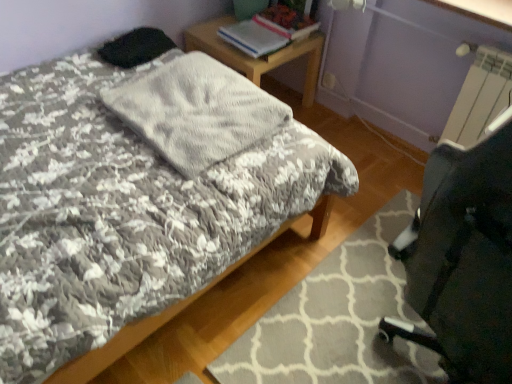
Question: Is fluffy gray blanket at center further to camera compared to gray textured rug at lower right?

Choices:
 (A) no
 (B) yes

Answer: (B)

Question: Is fluffy gray blanket at center bigger than gray textured rug at lower right?

Choices:
 (A) yes
 (B) no

Answer: (B)

Question: Considering the relative sizes of fluffy gray blanket at center and gray textured rug at lower right in the image provided, is fluffy gray blanket at center smaller than gray textured rug at lower right?

Choices:
 (A) no
 (B) yes

Answer: (B)

Question: Could you tell me if fluffy gray blanket at center is facing gray textured rug at lower right?

Choices:
 (A) no
 (B) yes

Answer: (A)

Question: From the image's perspective, would you say fluffy gray blanket at center is shown under gray textured rug at lower right?

Choices:
 (A) yes
 (B) no

Answer: (B)

Question: Are fluffy gray blanket at center and gray textured rug at lower right far apart?

Choices:
 (A) yes
 (B) no

Answer: (B)

Question: Is wooden desk at upper center not inside hardcover book at upper center, which appears as the first book when viewed from the right?

Choices:
 (A) no
 (B) yes

Answer: (B)

Question: Is wooden desk at upper center oriented towards hardcover book at upper center, the second book in the left-to-right sequence?

Choices:
 (A) no
 (B) yes

Answer: (A)

Question: Would you say hardcover book at upper center, which appears as the first book when viewed from the right, is part of wooden desk at upper center's contents?

Choices:
 (A) yes
 (B) no

Answer: (B)

Question: From a real-world perspective, is wooden desk at upper center physically below hardcover book at upper center, which appears as the first book when viewed from the right?

Choices:
 (A) yes
 (B) no

Answer: (A)

Question: Is wooden desk at upper center next to hardcover book at upper center, the second book in the left-to-right sequence, and touching it?

Choices:
 (A) yes
 (B) no

Answer: (B)

Question: Can you confirm if wooden desk at upper center is bigger than hardcover book at upper center, the second book in the left-to-right sequence?

Choices:
 (A) no
 (B) yes

Answer: (B)

Question: From the image's perspective, is gray textured rug at lower right located beneath hardcover book at upper center, positioned as the 1th book in left-to-right order?

Choices:
 (A) no
 (B) yes

Answer: (B)